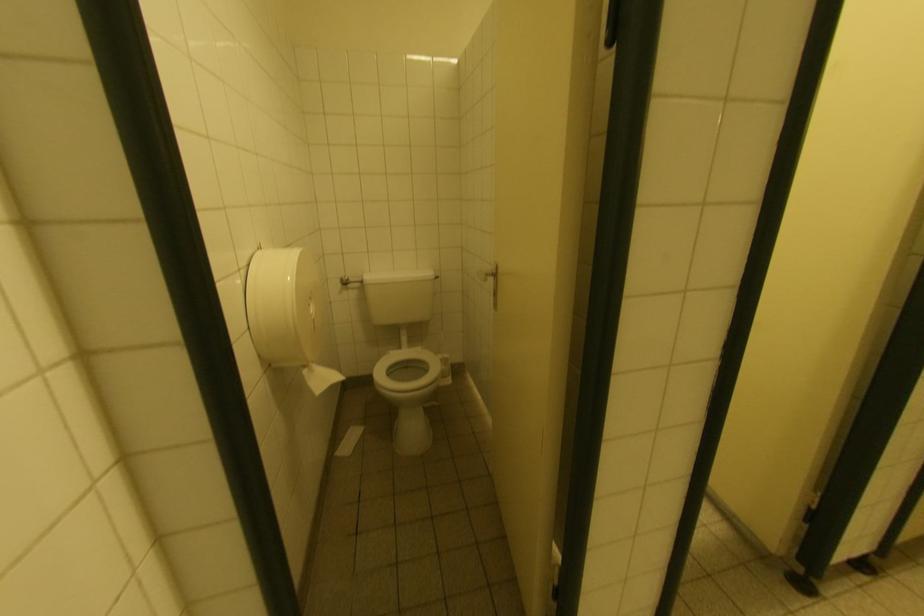
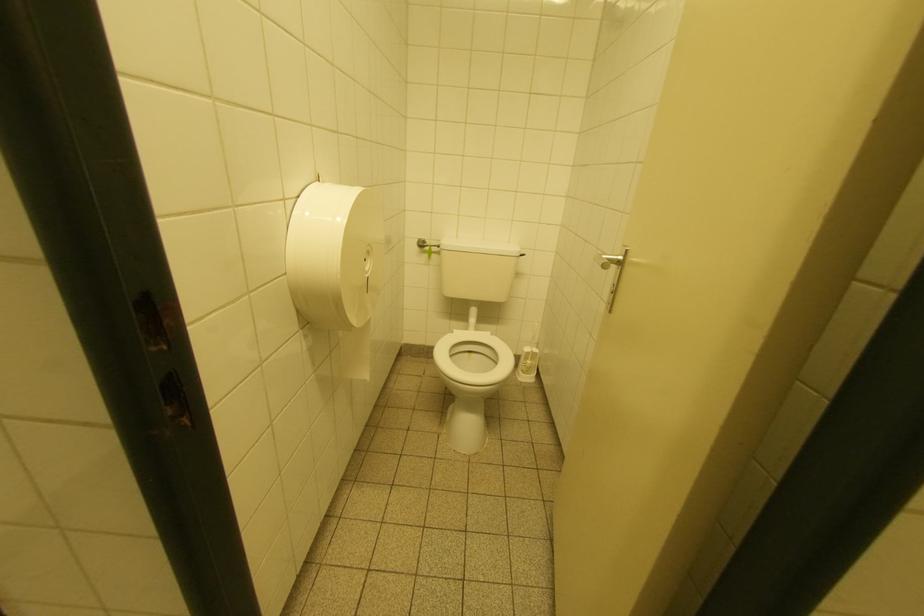
Question: The images are taken continuously from a first-person perspective. In which direction is your viewpoint rotating?

Choices:
 (A) Left
 (B) Right
 (C) Up
 (D) Down

Answer: (A)